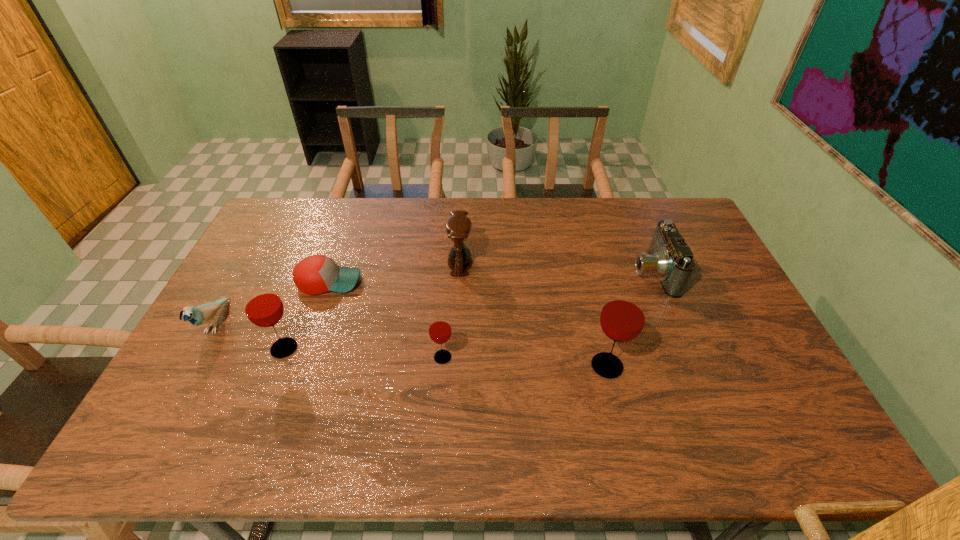
Considering the uniform spacing of glasss, where should an additional glass be positioned on the right? Please locate a free spot. Please provide its 2D coordinates. Your answer should be formatted as a tuple, i.e. [(x, y)], where the tuple contains the x and y coordinates of a point satisfying the conditions above.

[(777, 375)]